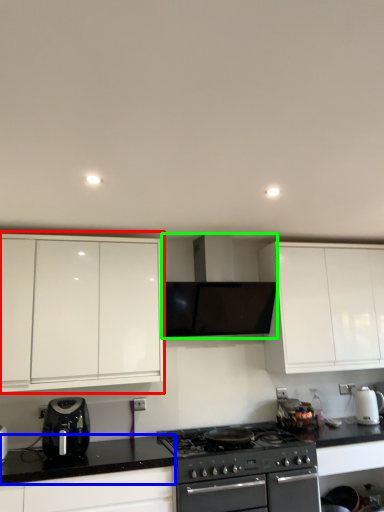
Question: Which object is positioned farthest from cabinetry (highlighted by a red box)? Select from counter top (highlighted by a blue box) and home appliance (highlighted by a green box).

Choices:
 (A) counter top
 (B) home appliance

Answer: (A)